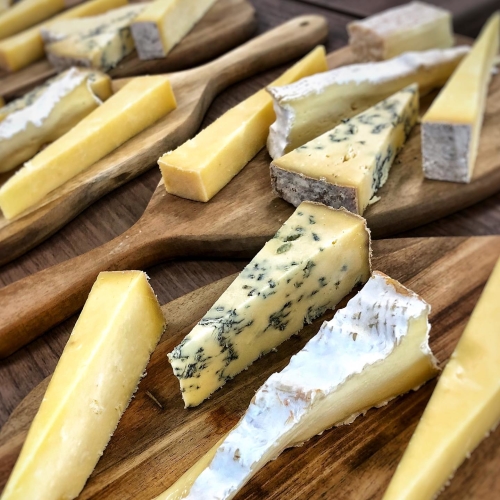
Find the location of a particular element. crumb is located at coordinates [377, 198].